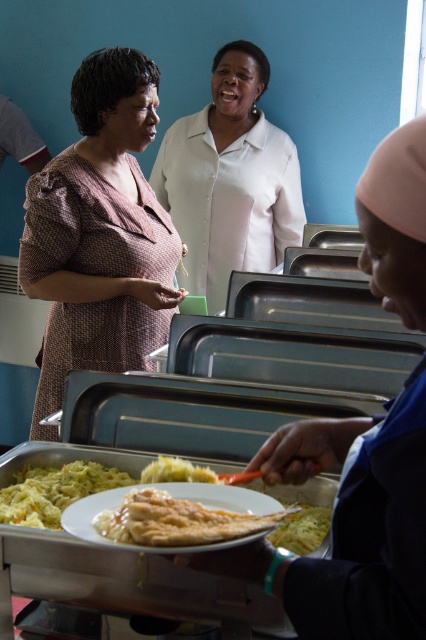
Question: Is golden-brown crispy flatbread at center smaller than yellowish matte rice at lower center?

Choices:
 (A) yes
 (B) no

Answer: (B)

Question: Considering the relative positions of golden brown crispy chicken at center and yellowish matte rice at lower center in the image provided, where is golden brown crispy chicken at center located with respect to yellowish matte rice at lower center?

Choices:
 (A) right
 (B) left

Answer: (A)

Question: Which object appears closest to the camera in this image?

Choices:
 (A) golden-brown crispy flatbread at center
 (B) yellowish matte pasta at lower center
 (C) white smooth shirt at upper center
 (D) brown textured dress at upper left

Answer: (B)

Question: Estimate the real-world distances between objects in this image. Which object is farther from the yellow matte shredded cabbage at center?

Choices:
 (A) golden-brown crispy flatbread at center
 (B) yellowish matte rice at lower center

Answer: (B)

Question: Considering the real-world distances, which object is closest to the golden-brown crispy flatbread at center?

Choices:
 (A) yellowish matte rice at lower center
 (B) white smooth shirt at upper center
 (C) yellowish matte pasta at lower center

Answer: (A)

Question: In this image, where is white smooth shirt at upper center located relative to yellow matte shredded cabbage at center?

Choices:
 (A) left
 (B) right

Answer: (B)